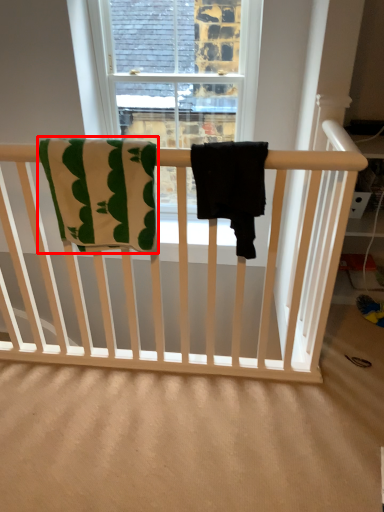
Question: Observing the image, what is the correct spatial positioning of beach towel (annotated by the red box) in reference to beach towel?

Choices:
 (A) left
 (B) right

Answer: (A)